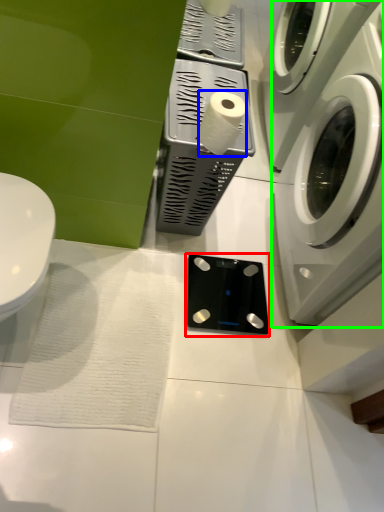
Question: Which is farther away from appliance (highlighted by a red box)? toilet paper (highlighted by a blue box) or washing machine (highlighted by a green box)?

Choices:
 (A) toilet paper
 (B) washing machine

Answer: (A)